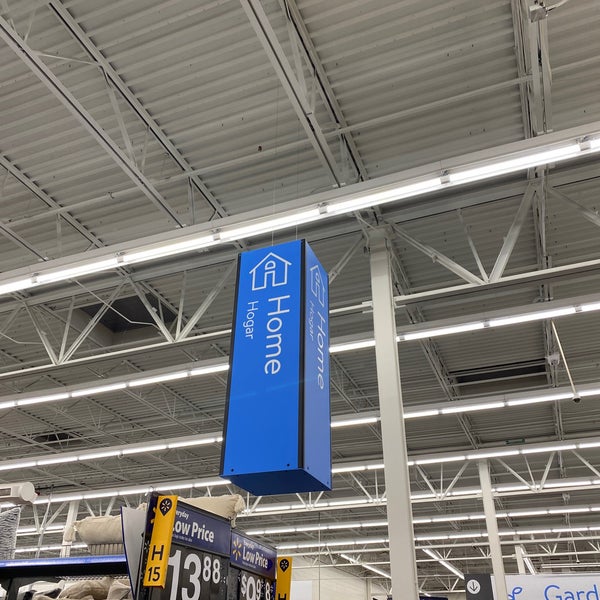
At what (x,y) coordinates should I click in order to perform the action: click on ceiling. Please return your answer as a coordinate pair (x, y). This screenshot has width=600, height=600. Looking at the image, I should click on (488, 345).